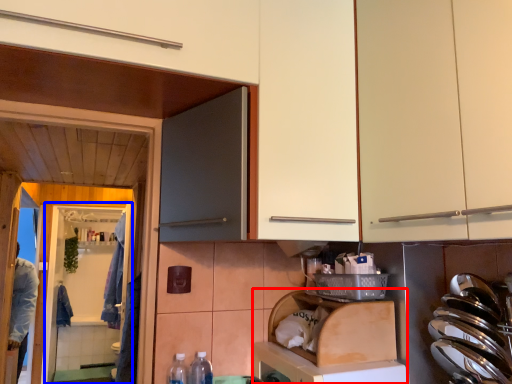
Question: Which of the following is the closest to the observer, dish washer (highlighted by a red box) or screen door (highlighted by a blue box)?

Choices:
 (A) dish washer
 (B) screen door

Answer: (A)